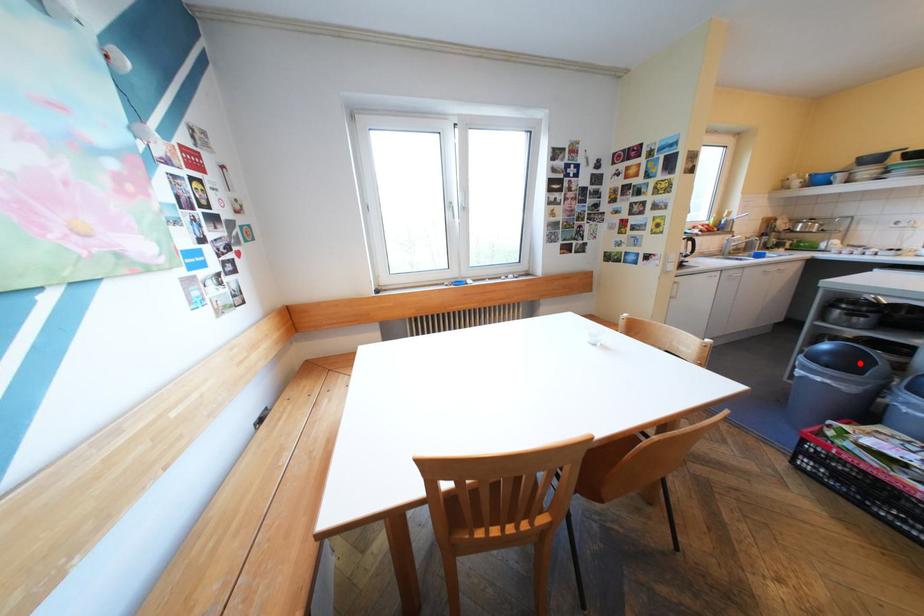
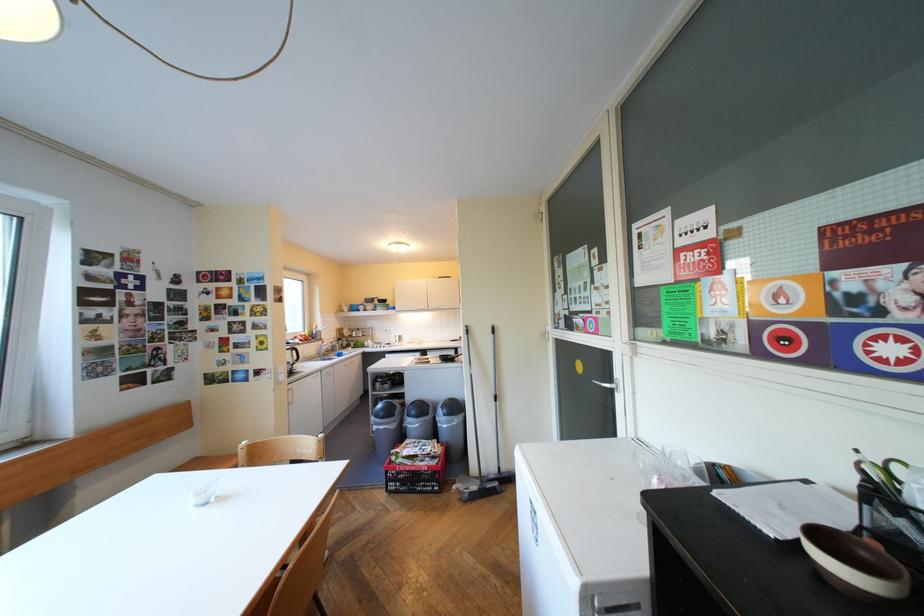
In the second image, find the point that corresponds to the highlighted location in the first image.

(402, 411)